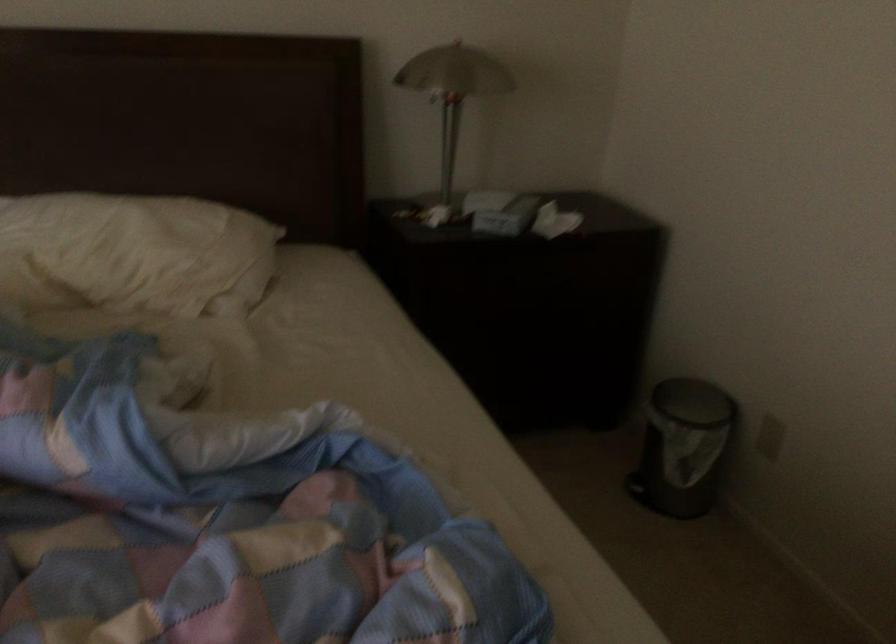
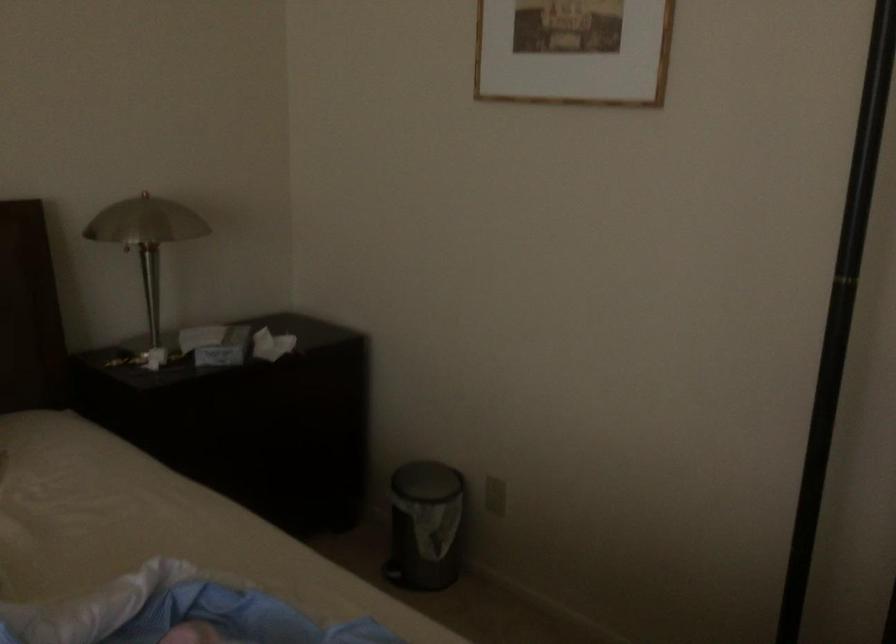
What movement of the cameraman would produce the second image?

The cameraman moved toward left, backward.